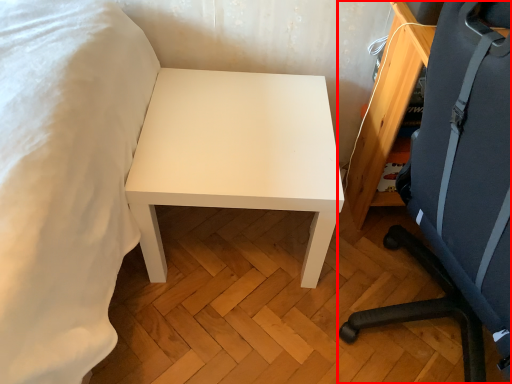
Question: From the image's perspective, where is chair (annotated by the red box) located relative to table?

Choices:
 (A) below
 (B) above

Answer: (A)